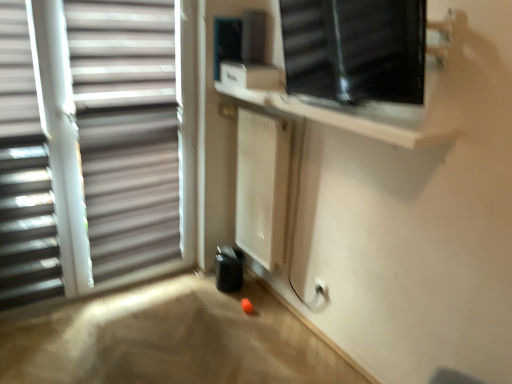
The image size is (512, 384). Describe the element at coordinates (355, 50) in the screenshot. I see `transparent glass window at upper right, which is counted as the first window, starting from the right` at that location.

Find the location of a particular element. Image resolution: width=512 pixels, height=384 pixels. white matte window blind at left is located at coordinates pos(24,172).

Describe the element at coordinates (100, 157) in the screenshot. I see `white matte window at left, which is counted as the 2th window, starting from the right` at that location.

What is the approximate width of white matte radiator at center?

The width of white matte radiator at center is 20.39 centimeters.

You are a GUI agent. You are given a task and a screenshot of the screen. Output one action in this format:
    pyautogui.click(x=<x>, y=<y>)
    Task: Click on the white matte radiator at center
    
    Given the screenshot: What is the action you would take?
    pyautogui.click(x=262, y=185)

Where is `transparent glass window at upper right, which is counted as the first window, starting from the right`? This screenshot has width=512, height=384. transparent glass window at upper right, which is counted as the first window, starting from the right is located at coordinates (355, 50).

In the scene shown: Which object is thinner, white matte radiator at center or white matte window blind at left?

white matte window blind at left is thinner.

You are a GUI agent. You are given a task and a screenshot of the screen. Output one action in this format:
    pyautogui.click(x=<x>, y=<y>)
    Task: Click on the window blind that appears in front of the white matte radiator at center
    The width and height of the screenshot is (512, 384).
    Given the screenshot: What is the action you would take?
    pyautogui.click(x=24, y=172)

Consider the image. Is white matte window blind at left at the back of white matte radiator at center?

That's not correct — white matte radiator at center is not looking away from white matte window blind at left.

From the image's perspective, is white matte window at left, which appears as the first window when viewed from the left, above or below white matte window blind at left?

Based on their image positions, white matte window at left, which appears as the first window when viewed from the left, is located above white matte window blind at left.

Considering the relative sizes of white matte window at left, which appears as the first window when viewed from the left, and white matte window blind at left in the image provided, is white matte window at left, which appears as the first window when viewed from the left, taller than white matte window blind at left?

Yes, white matte window at left, which appears as the first window when viewed from the left, is taller than white matte window blind at left.

Is white matte window at left, which appears as the first window when viewed from the left, turned away from white matte window blind at left?

Yes.

From a real-world perspective, who is located lower, white matte window at left, which is counted as the 2th window, starting from the right, or white matte window blind at left?

white matte window blind at left.

Which object is thinner, transparent glass window at upper right, marked as the second window in a left-to-right arrangement, or white matte window blind at left?

Thinner between the two is white matte window blind at left.

Find the location of a particular element. The width and height of the screenshot is (512, 384). window that is in front of the white matte window blind at left is located at coordinates (355, 50).

Looking at this image, measure the distance from transparent glass window at upper right, marked as the second window in a left-to-right arrangement, to white matte window blind at left.

transparent glass window at upper right, marked as the second window in a left-to-right arrangement, is 1.40 meters from white matte window blind at left.

Between transparent glass window at upper right, marked as the second window in a left-to-right arrangement, and white matte window blind at left, which one appears on the right side from the viewer's perspective?

transparent glass window at upper right, marked as the second window in a left-to-right arrangement, is more to the right.

Considering the points (40, 259) and (246, 144), which point is in front, point (40, 259) or point (246, 144)?

Positioned in front is point (40, 259).

Based on the photo, is the depth of white matte window blind at left less than that of white matte radiator at center?

That is True.

Is white matte window blind at left thinner than white matte radiator at center?

Indeed, white matte window blind at left has a lesser width compared to white matte radiator at center.

Would you say transparent glass window at upper right, marked as the second window in a left-to-right arrangement, is to the left or to the right of white matte window at left, which is counted as the 2th window, starting from the right, in the picture?

In the image, transparent glass window at upper right, marked as the second window in a left-to-right arrangement, appears on the right side of white matte window at left, which is counted as the 2th window, starting from the right.

From the image's perspective, is transparent glass window at upper right, which is counted as the first window, starting from the right, below white matte window at left, which appears as the first window when viewed from the left?

No.

Locate an element on the screen. This screenshot has width=512, height=384. window lying behind the transparent glass window at upper right, which is counted as the first window, starting from the right is located at coordinates (100, 157).

Looking at this image, is transparent glass window at upper right, marked as the second window in a left-to-right arrangement, smaller than white matte window at left, which is counted as the 2th window, starting from the right?

Yes.

Is white matte window at left, which appears as the first window when viewed from the left, next to white matte radiator at center and touching it?

No, white matte window at left, which appears as the first window when viewed from the left, is not beside white matte radiator at center.

Considering the sizes of objects white matte window at left, which is counted as the 2th window, starting from the right, and white matte radiator at center in the image provided, who is thinner, white matte window at left, which is counted as the 2th window, starting from the right, or white matte radiator at center?

Thinner between the two is white matte window at left, which is counted as the 2th window, starting from the right.

How much distance is there between white matte window at left, which appears as the first window when viewed from the left, and white matte radiator at center?

white matte window at left, which appears as the first window when viewed from the left, and white matte radiator at center are 27.23 inches apart.

Who is smaller, white matte window at left, which is counted as the 2th window, starting from the right, or white matte radiator at center?

Smaller between the two is white matte radiator at center.

Considering the sizes of white matte window at left, which appears as the first window when viewed from the left, and transparent glass window at upper right, which is counted as the first window, starting from the right, in the image, is white matte window at left, which appears as the first window when viewed from the left, bigger or smaller than transparent glass window at upper right, which is counted as the first window, starting from the right,?

white matte window at left, which appears as the first window when viewed from the left, is bigger than transparent glass window at upper right, which is counted as the first window, starting from the right.

Measure the distance from white matte window at left, which is counted as the 2th window, starting from the right, to transparent glass window at upper right, marked as the second window in a left-to-right arrangement.

white matte window at left, which is counted as the 2th window, starting from the right, and transparent glass window at upper right, marked as the second window in a left-to-right arrangement, are 3.63 feet apart from each other.

Consider the image. Is white matte window at left, which appears as the first window when viewed from the left, aimed at transparent glass window at upper right, marked as the second window in a left-to-right arrangement?

Yes, white matte window at left, which appears as the first window when viewed from the left, is facing transparent glass window at upper right, marked as the second window in a left-to-right arrangement.

Is white matte window at left, which appears as the first window when viewed from the left, far away from transparent glass window at upper right, which is counted as the first window, starting from the right?

Yes, white matte window at left, which appears as the first window when viewed from the left, is far from transparent glass window at upper right, which is counted as the first window, starting from the right.

This screenshot has height=384, width=512. In order to click on window blind above the white matte radiator at center (from the image's perspective) in this screenshot , I will do tap(24, 172).

The image size is (512, 384). In order to click on window blind that is in front of the white matte window at left, which appears as the first window when viewed from the left in this screenshot , I will do `click(24, 172)`.

Looking at the image, which one is located further to white matte window at left, which appears as the first window when viewed from the left, white matte window blind at left or transparent glass window at upper right, marked as the second window in a left-to-right arrangement?

transparent glass window at upper right, marked as the second window in a left-to-right arrangement.

Looking at the image, which one is located closer to white matte window blind at left, white matte radiator at center or transparent glass window at upper right, which is counted as the first window, starting from the right?

white matte radiator at center lies closer to white matte window blind at left than the other object.

Looking at the image, which one is located further to white matte radiator at center, transparent glass window at upper right, marked as the second window in a left-to-right arrangement, or white matte window blind at left?

white matte window blind at left is further to white matte radiator at center.

From the image, which object appears to be farther from transparent glass window at upper right, marked as the second window in a left-to-right arrangement, white matte window blind at left or white matte window at left, which is counted as the 2th window, starting from the right?

white matte window blind at left is positioned further to the anchor transparent glass window at upper right, marked as the second window in a left-to-right arrangement.

Considering their positions, is white matte window blind at left positioned closer to transparent glass window at upper right, marked as the second window in a left-to-right arrangement, than white matte radiator at center?

The object closer to transparent glass window at upper right, marked as the second window in a left-to-right arrangement, is white matte radiator at center.

Which object lies further to the anchor point transparent glass window at upper right, which is counted as the first window, starting from the right, white matte radiator at center or white matte window at left, which is counted as the 2th window, starting from the right?

Based on the image, white matte window at left, which is counted as the 2th window, starting from the right, appears to be further to transparent glass window at upper right, which is counted as the first window, starting from the right.

From the picture: Based on their spatial positions, is white matte radiator at center or white matte window at left, which is counted as the 2th window, starting from the right, closer to white matte window blind at left?

white matte window at left, which is counted as the 2th window, starting from the right, lies closer to white matte window blind at left than the other object.

When comparing their distances from transparent glass window at upper right, which is counted as the first window, starting from the right, does white matte window at left, which is counted as the 2th window, starting from the right, or white matte window blind at left seem closer?

The object closer to transparent glass window at upper right, which is counted as the first window, starting from the right, is white matte window at left, which is counted as the 2th window, starting from the right.

At what (x,y) coordinates should I click in order to perform the action: click on radiator between white matte window blind at left and transparent glass window at upper right, which is counted as the first window, starting from the right, in the horizontal direction. Please return your answer as a coordinate pair (x, y). Looking at the image, I should click on (262, 185).

Where is `radiator between white matte window at left, which appears as the first window when viewed from the left, and transparent glass window at upper right, which is counted as the first window, starting from the right, in the horizontal direction`? This screenshot has height=384, width=512. radiator between white matte window at left, which appears as the first window when viewed from the left, and transparent glass window at upper right, which is counted as the first window, starting from the right, in the horizontal direction is located at coordinates (262, 185).

In order to click on window between white matte window blind at left and white matte radiator at center from left to right in this screenshot , I will do `click(100, 157)`.

At what (x,y) coordinates should I click in order to perform the action: click on window situated between white matte window blind at left and transparent glass window at upper right, which is counted as the first window, starting from the right, from left to right. Please return your answer as a coordinate pair (x, y). This screenshot has height=384, width=512. Looking at the image, I should click on (100, 157).